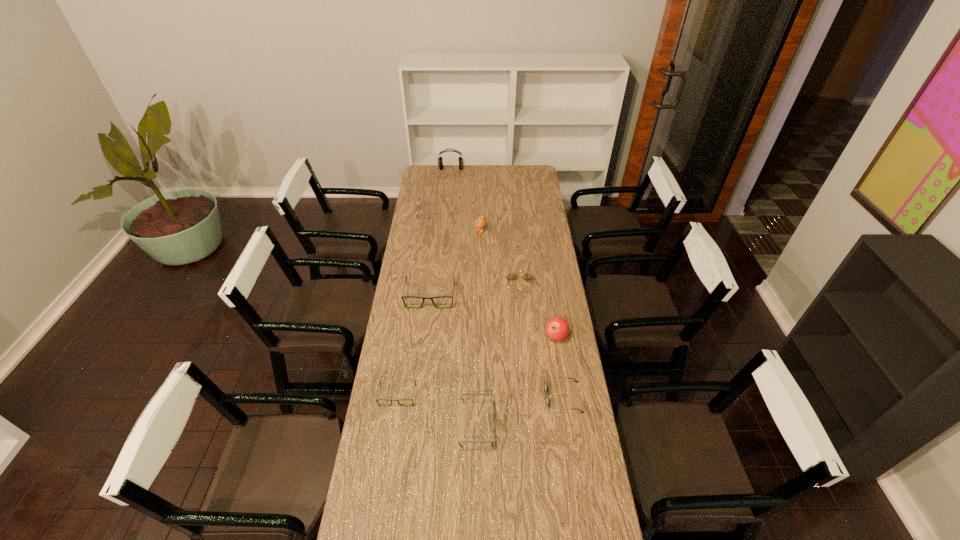
This screenshot has height=540, width=960. I want to click on the fourth closest object to the apple, so click(403, 296).

This screenshot has width=960, height=540. Find the location of `spectacles that is the third closest one to the rightmost spectacles`. spectacles that is the third closest one to the rightmost spectacles is located at coordinates (418, 206).

You are a GUI agent. You are given a task and a screenshot of the screen. Output one action in this format:
    pyautogui.click(x=<x>, y=<y>)
    Task: Click on the spectacles object that ranks as the second closest to the second biggest black spectacles
    This screenshot has width=960, height=540.
    Given the screenshot: What is the action you would take?
    pyautogui.click(x=403, y=296)

Identify the location of the third closest black spectacles to the sunglasses. (403, 296).

Image resolution: width=960 pixels, height=540 pixels. I want to click on black spectacles that is the third nearest to the brown teddy bear, so click(492, 440).

You are a GUI agent. You are given a task and a screenshot of the screen. Output one action in this format:
    pyautogui.click(x=<x>, y=<y>)
    Task: Click on the free location that satisfies the following two spatial constraints: 1. on the lens of the biggest black spectacles; 2. on the left side of the sixth farthest object
    The image size is (960, 540).
    Given the screenshot: What is the action you would take?
    pyautogui.click(x=425, y=336)

This screenshot has height=540, width=960. I want to click on free location that satisfies the following two spatial constraints: 1. on the ear cups of the headset; 2. on the front-facing side of the left yellow spectacles, so click(447, 213).

Locate an element on the screen. The height and width of the screenshot is (540, 960). vacant space that satisfies the following two spatial constraints: 1. on the back side of the red apple; 2. on the face of the brown teddy bear is located at coordinates (540, 232).